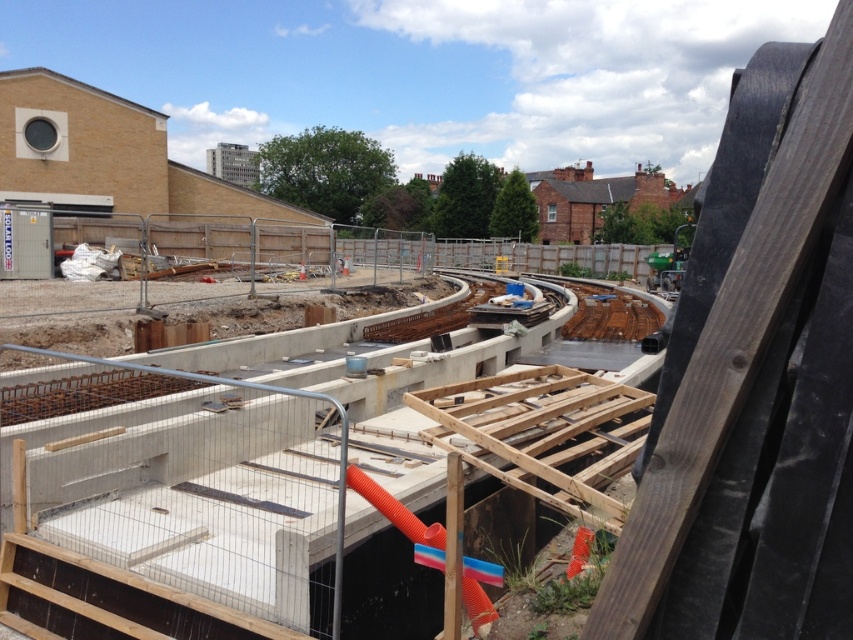
Question: Which point is farther to the camera?

Choices:
 (A) wooden at center
 (B) concrete at center

Answer: (A)

Question: Is concrete at center above wooden at center?

Choices:
 (A) yes
 (B) no

Answer: (B)

Question: Is concrete at center smaller than wooden at center?

Choices:
 (A) no
 (B) yes

Answer: (B)

Question: Which of the following is the closest to the observer?

Choices:
 (A) (289, 538)
 (B) (659, 326)

Answer: (A)

Question: In this image, where is concrete at center located relative to wooden at center?

Choices:
 (A) left
 (B) right

Answer: (A)